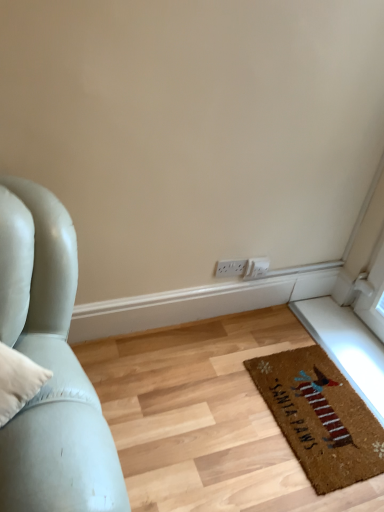
Image resolution: width=384 pixels, height=512 pixels. In order to click on vacant space behind brown coir mat at lower right in this screenshot , I will do `click(289, 328)`.